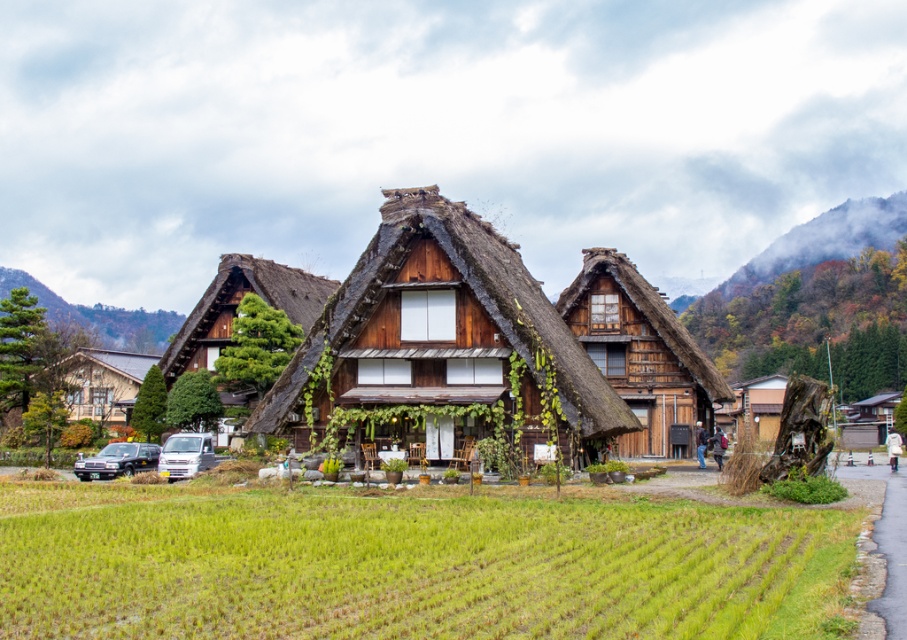
You are standing in the garden in front of the wooden thatched cottage at center. If you walk straight ahead, will you eventually reach the point represented by point (641, 353)?

Yes, because the wooden thatched cottage at center is represented by point (641, 353), so walking straight ahead from the garden in front of it would lead you directly to that point.

You are standing in the garden area of the rural Japanese scene. You see a point marked at coordinates (439, 344). What does this point indicate?

The point at coordinates (439, 344) corresponds to the thatched wood cottage at center.